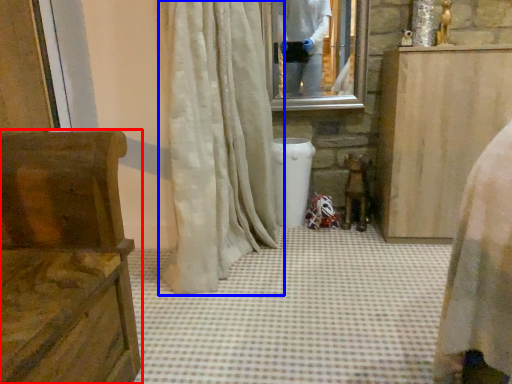
Question: Which object is closer to the camera taking this photo, furniture (highlighted by a red box) or curtain (highlighted by a blue box)?

Choices:
 (A) furniture
 (B) curtain

Answer: (A)